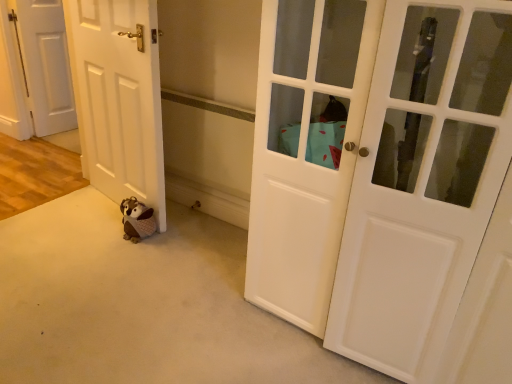
Question: From the image's perspective, would you say white matte door at left, arranged as the 2th door when viewed from the left, is shown under plush brown bear at lower left?

Choices:
 (A) no
 (B) yes

Answer: (A)

Question: Is white matte door at left, arranged as the second door when viewed from the front, facing towards plush brown bear at lower left?

Choices:
 (A) yes
 (B) no

Answer: (A)

Question: Is white matte door at left, arranged as the second door when viewed from the front, taller than plush brown bear at lower left?

Choices:
 (A) yes
 (B) no

Answer: (A)

Question: Is white matte door at left, arranged as the 2th door when viewed from the left, beside plush brown bear at lower left?

Choices:
 (A) no
 (B) yes

Answer: (A)

Question: Can you confirm if white matte door at left, the 2th door positioned from the right, is wider than plush brown bear at lower left?

Choices:
 (A) no
 (B) yes

Answer: (A)

Question: Is white matte door at left, the 2th door positioned from the right, not within plush brown bear at lower left?

Choices:
 (A) no
 (B) yes

Answer: (B)

Question: Is white matte door at left, the second door in the back-to-front sequence, looking in the opposite direction of white glossy door at center, placed as the 3th door when sorted from left to right?

Choices:
 (A) no
 (B) yes

Answer: (A)

Question: Could you tell me if white matte door at left, the second door in the back-to-front sequence, is facing white glossy door at center, placed as the 3th door when sorted from left to right?

Choices:
 (A) yes
 (B) no

Answer: (B)

Question: Is white matte door at left, arranged as the second door when viewed from the front, in contact with white glossy door at center, which is counted as the 3th door, starting from the back?

Choices:
 (A) no
 (B) yes

Answer: (A)

Question: From a real-world perspective, is white matte door at left, the 2th door positioned from the right, located beneath white glossy door at center, which is counted as the 3th door, starting from the back?

Choices:
 (A) no
 (B) yes

Answer: (B)

Question: Considering the relative sizes of white matte door at left, the 2th door positioned from the right, and white glossy door at center, acting as the 1th door starting from the right, in the image provided, is white matte door at left, the 2th door positioned from the right, shorter than white glossy door at center, acting as the 1th door starting from the right,?

Choices:
 (A) yes
 (B) no

Answer: (A)

Question: Can you confirm if white matte door at left, arranged as the second door when viewed from the front, is thinner than white glossy door at center, placed as the 3th door when sorted from left to right?

Choices:
 (A) no
 (B) yes

Answer: (B)

Question: Is plush brown bear at lower left at the back of white glossy door at center, placed as the 3th door when sorted from left to right?

Choices:
 (A) no
 (B) yes

Answer: (A)